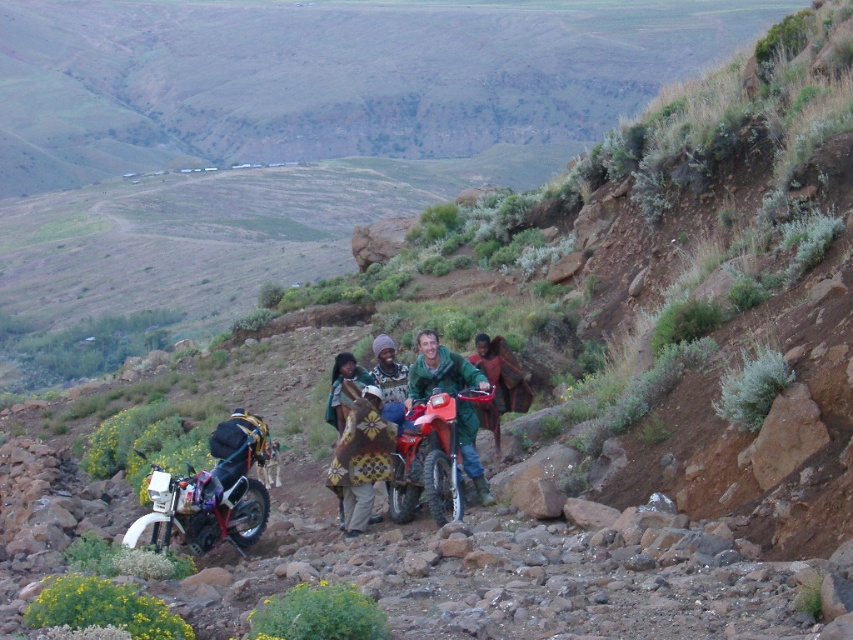
Does matte black motorcycle at lower left have a smaller size compared to knitted wool sweater at center?

No, matte black motorcycle at lower left is not smaller than knitted wool sweater at center.

Can you confirm if matte black motorcycle at lower left is positioned below knitted wool sweater at center?

Correct, matte black motorcycle at lower left is located below knitted wool sweater at center.

Is point (148, 497) more distant than point (393, 381)?

No, it is not.

Locate an element on the screen. This screenshot has width=853, height=640. matte black motorcycle at lower left is located at coordinates (212, 492).

Between point (236, 541) and point (345, 493), which one is positioned behind?

Point (236, 541)

Who is more forward, (x=207, y=516) or (x=346, y=477)?

Point (x=346, y=477) is more forward.

Measure the distance between point (248,506) and camera.

Point (248,506) is 18.12 meters away from camera.

You are a GUI agent. You are given a task and a screenshot of the screen. Output one action in this format:
    pyautogui.click(x=<x>, y=<y>)
    Task: Click on the matte black motorcycle at lower left
    The width and height of the screenshot is (853, 640).
    Given the screenshot: What is the action you would take?
    pyautogui.click(x=212, y=492)

Can you confirm if matte red dirt bike at center is positioned below knitted wool sweater at center?

Correct, matte red dirt bike at center is located below knitted wool sweater at center.

Who is lower down, matte red dirt bike at center or knitted wool sweater at center?

matte red dirt bike at center is lower down.

Locate an element on the screen. This screenshot has width=853, height=640. matte red dirt bike at center is located at coordinates (431, 458).